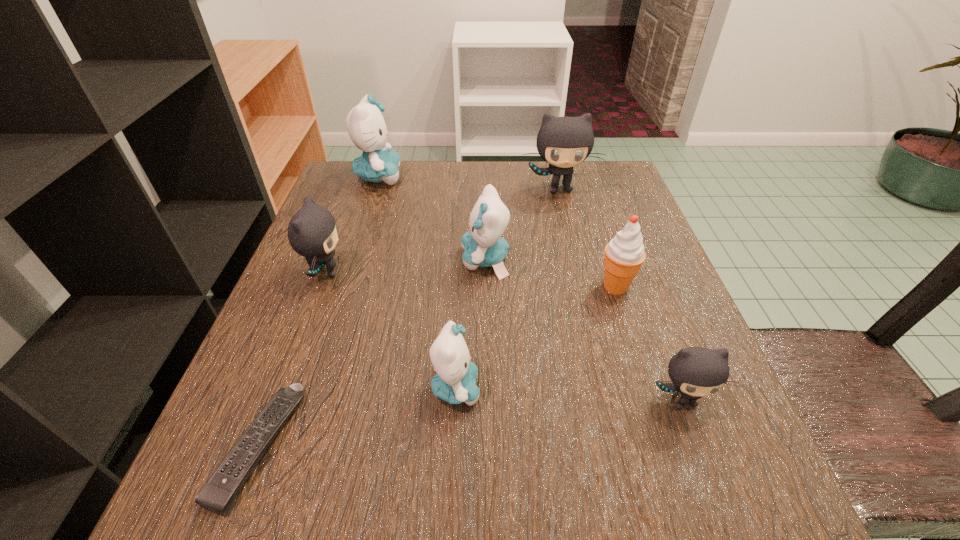
The image size is (960, 540). Identify the location of object present at the near edge. (219, 493).

I want to click on remote control that is at the left edge, so click(x=219, y=493).

Identify the location of icecream that is positioned at the right edge. (624, 254).

You are a GUI agent. You are given a task and a screenshot of the screen. Output one action in this format:
    pyautogui.click(x=<x>, y=<y>)
    Task: Click on the object located at the far left corner
    This screenshot has width=960, height=540.
    Given the screenshot: What is the action you would take?
    pyautogui.click(x=365, y=124)

Identify the location of object present at the near left corner. (219, 493).

This screenshot has width=960, height=540. I want to click on object that is at the far right corner, so click(564, 142).

In the image, there is a desktop. At what (x,y) coordinates should I click in order to perform the action: click on vacant space at the far edge. Please return your answer as a coordinate pair (x, y). The width and height of the screenshot is (960, 540). Looking at the image, I should click on (440, 205).

Locate an element on the screen. The image size is (960, 540). free space at the near edge is located at coordinates (405, 515).

Locate an element on the screen. This screenshot has height=540, width=960. vacant space at the left edge of the desktop is located at coordinates (350, 320).

In the image, there is a desktop. Identify the location of vacant space at the right edge. This screenshot has width=960, height=540. (626, 343).